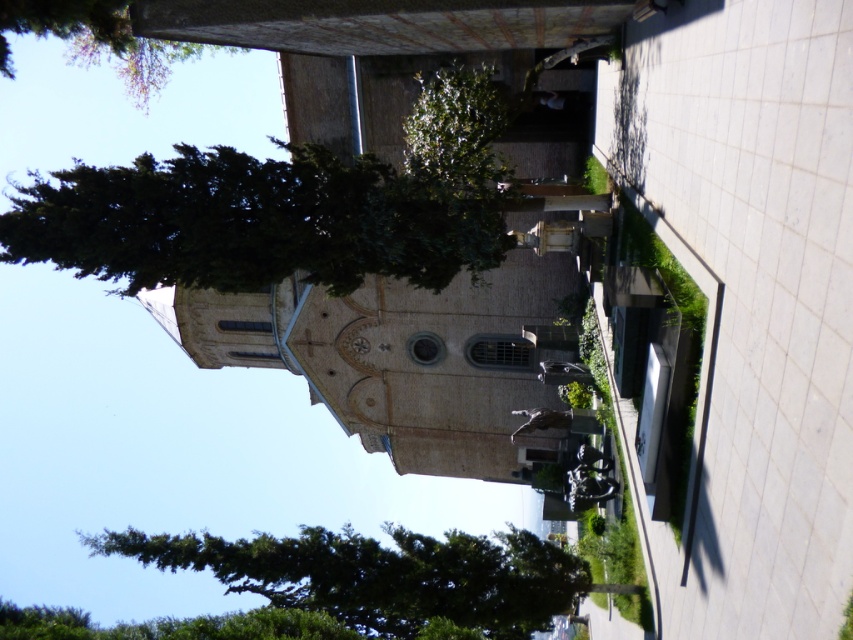
You are standing at the point marked by the coordinates point (x=265, y=218) in the image. What is the nearest object to you?

The point (x=265, y=218) is on dark green leafy tree at upper left, so the nearest object to you is the dark green leafy tree at upper left.

You are planning to place a bench between the green textured tree at left and the green leafy tree at upper left. Based on their widths, which tree should the bench be closer to to ensure it doesn

The bench should be placed closer to the green leafy tree at upper left because the green textured tree at left is wider, leaving less space between them.